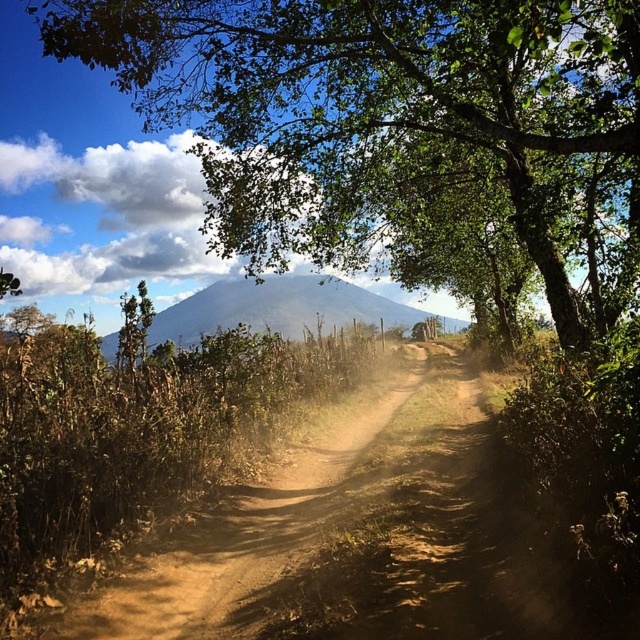
Question: Is green leafy tree at center positioned in front of gray matte mountain at center?

Choices:
 (A) no
 (B) yes

Answer: (B)

Question: Which object appears farthest from the camera in this image?

Choices:
 (A) gray matte mountain at center
 (B) green leafy tree at center

Answer: (A)

Question: Which point appears closest to the camera in this image?

Choices:
 (A) (547, 268)
 (B) (212, 308)

Answer: (A)

Question: Does green leafy tree at center have a greater width compared to gray matte mountain at center?

Choices:
 (A) no
 (B) yes

Answer: (A)

Question: Which object is closer to the camera taking this photo?

Choices:
 (A) gray matte mountain at center
 (B) green leafy tree at center

Answer: (B)

Question: Does green leafy tree at center have a greater width compared to gray matte mountain at center?

Choices:
 (A) yes
 (B) no

Answer: (B)